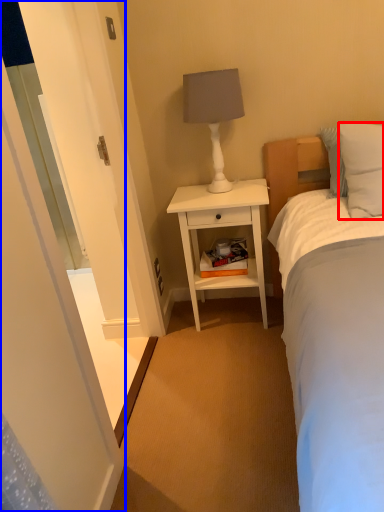
Question: Which of the following is the farthest to the observer, pillow (highlighted by a red box) or screen door (highlighted by a blue box)?

Choices:
 (A) pillow
 (B) screen door

Answer: (A)